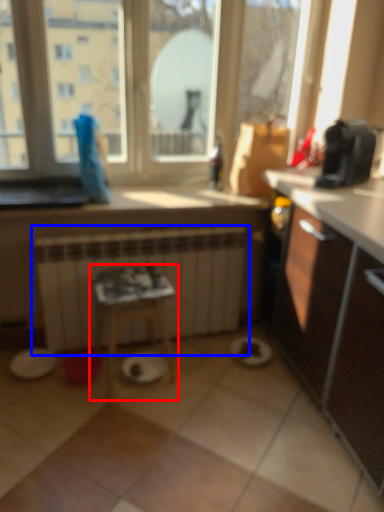
Question: Among these objects, which one is nearest to the camera, table (highlighted by a red box) or radiator (highlighted by a blue box)?

Choices:
 (A) table
 (B) radiator

Answer: (A)